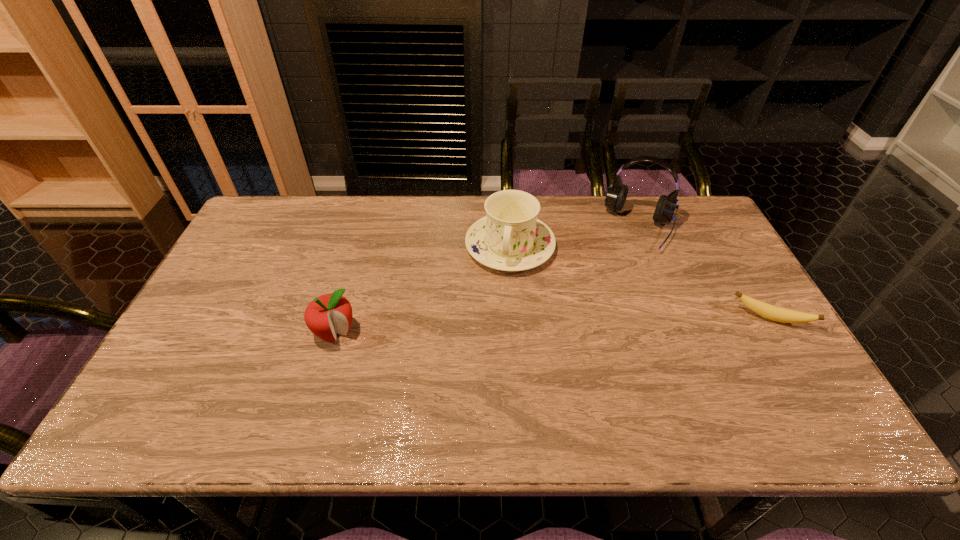
Locate an element on the screen. The image size is (960, 540). vacant region located on the ear cushions of the tallest object is located at coordinates (607, 325).

Image resolution: width=960 pixels, height=540 pixels. Find the location of `free space located on the handle side of the chinaware`. free space located on the handle side of the chinaware is located at coordinates (495, 320).

At what (x,y) coordinates should I click in order to perform the action: click on vacant position located 0.280m on the handle side of the chinaware. Please return your answer as a coordinate pair (x, y). The height and width of the screenshot is (540, 960). Looking at the image, I should click on (489, 357).

The width and height of the screenshot is (960, 540). I want to click on free point located 0.170m on the handle side of the chinaware, so click(495, 322).

Locate an element on the screen. headset positioned at the far edge is located at coordinates (616, 195).

Find the location of a particular element. chinaware that is at the far edge is located at coordinates (510, 237).

I want to click on banana that is at the right edge, so click(x=784, y=315).

Locate an element on the screen. This screenshot has height=540, width=960. headset situated at the right edge is located at coordinates (616, 195).

Locate an element on the screen. Image resolution: width=960 pixels, height=540 pixels. object at the far right corner is located at coordinates (616, 195).

At what (x,y) coordinates should I click in order to perform the action: click on vacant space at the far edge of the desktop. Please return your answer as a coordinate pair (x, y). The width and height of the screenshot is (960, 540). Looking at the image, I should click on (335, 235).